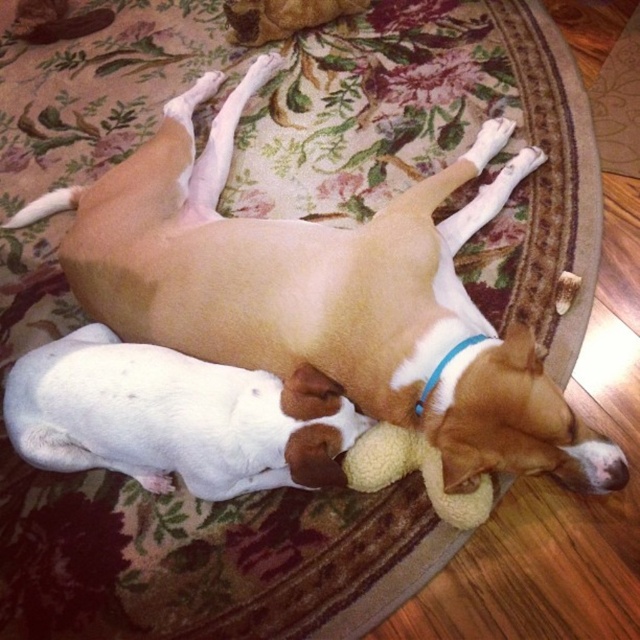
Describe the element at coordinates (324, 292) in the screenshot. The height and width of the screenshot is (640, 640). I see `brown matte dog at center` at that location.

Does brown matte dog at center have a larger size compared to white smooth dog at center?

Yes.

Which is behind, point (208, 212) or point (60, 435)?

Positioned behind is point (208, 212).

Locate an element on the screen. The height and width of the screenshot is (640, 640). brown matte dog at center is located at coordinates [324, 292].

Is point (186, 305) behind point (380, 451)?

Yes, point (186, 305) is farther from viewer.

Describe the element at coordinates (324, 292) in the screenshot. The width and height of the screenshot is (640, 640). I see `brown matte dog at center` at that location.

Which is in front, point (134, 310) or point (378, 435)?

Point (378, 435) is in front.

Image resolution: width=640 pixels, height=640 pixels. In order to click on brown matte dog at center in this screenshot , I will do `click(324, 292)`.

Can you confirm if white smooth dog at center is positioned below fluffy yellow toy at lower center?

Actually, white smooth dog at center is above fluffy yellow toy at lower center.

Can you confirm if white smooth dog at center is bigger than fluffy yellow toy at lower center?

Indeed, white smooth dog at center has a larger size compared to fluffy yellow toy at lower center.

Which is behind, point (332, 442) or point (490, 486)?

Positioned behind is point (490, 486).

Where is `white smooth dog at center`? white smooth dog at center is located at coordinates pyautogui.click(x=176, y=417).